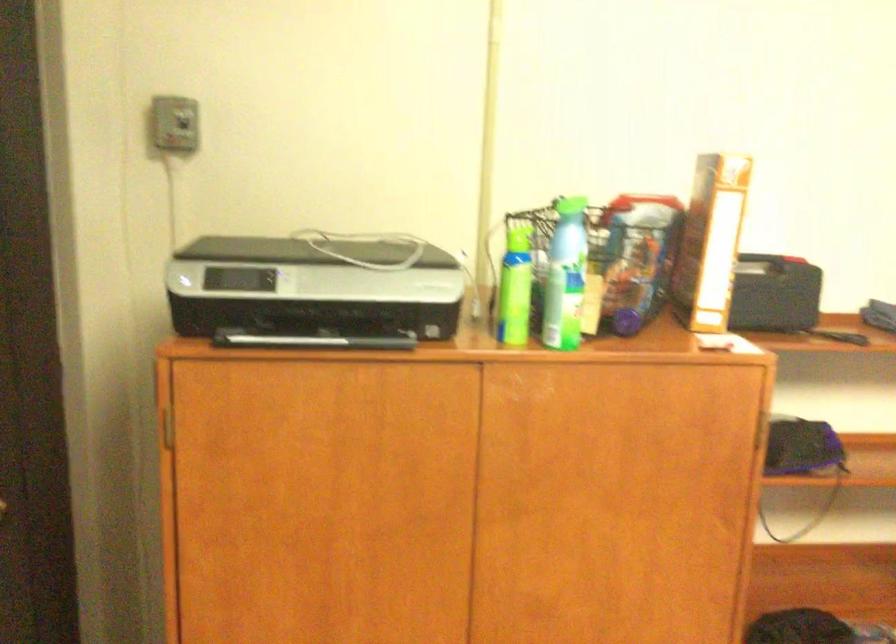
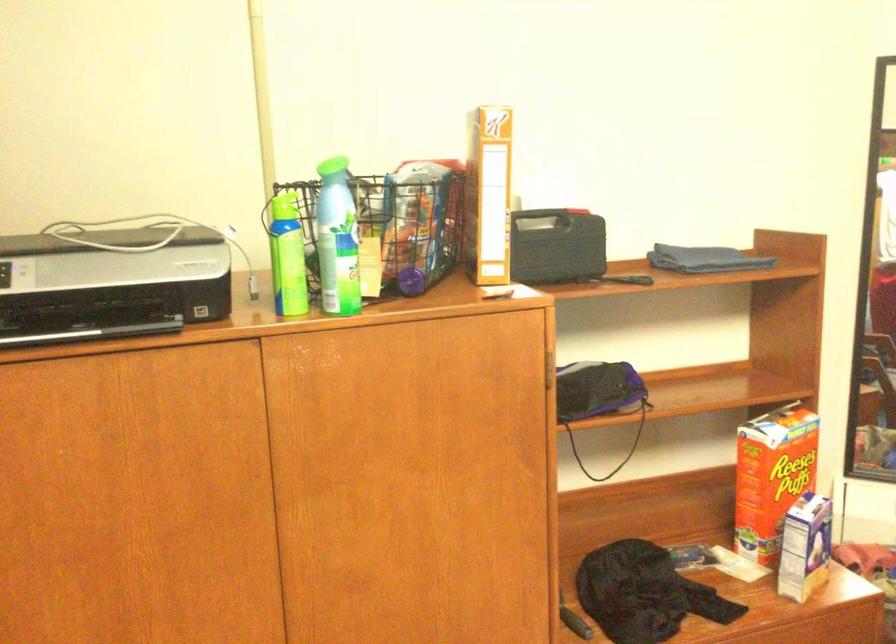
Question: The camera is either moving clockwise (left) or counter-clockwise (right) around the object. The first image is from the beginning of the video and the second image is from the end. Is the camera moving left or right when shooting the video?

Choices:
 (A) Left
 (B) Right

Answer: (A)